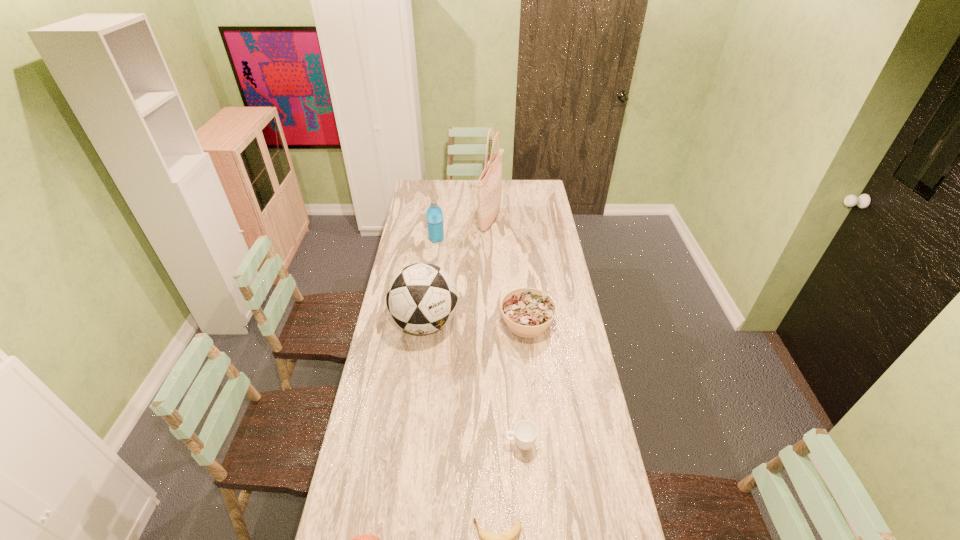
Identify the location of vacant region at the far edge of the desktop. The image size is (960, 540). (440, 197).

In order to click on vacant space at the left edge in this screenshot , I will do `click(384, 413)`.

The width and height of the screenshot is (960, 540). In order to click on free space at the right edge in this screenshot , I will do coord(530,211).

In the image, there is a desktop. At what (x,y) coordinates should I click in order to perform the action: click on vacant space at the far left corner. Please return your answer as a coordinate pair (x, y). Looking at the image, I should click on (430, 189).

Find the location of a particular element. The width and height of the screenshot is (960, 540). unoccupied position between the fifth tallest object and the shopping bag is located at coordinates (509, 272).

Find the location of a particular element. The image size is (960, 540). free space between the soccer ball and the cup is located at coordinates (472, 383).

In order to click on vacant area that lies between the shopping bag and the salad in this screenshot , I will do `click(509, 272)`.

Image resolution: width=960 pixels, height=540 pixels. What are the coordinates of `free area in between the sixth farthest object and the fourth tallest object` in the screenshot? It's located at (478, 341).

I want to click on free spot between the soccer ball and the tallest object, so click(x=458, y=272).

Where is `object that is the third closest to the shopping bag`? This screenshot has height=540, width=960. object that is the third closest to the shopping bag is located at coordinates (422, 298).